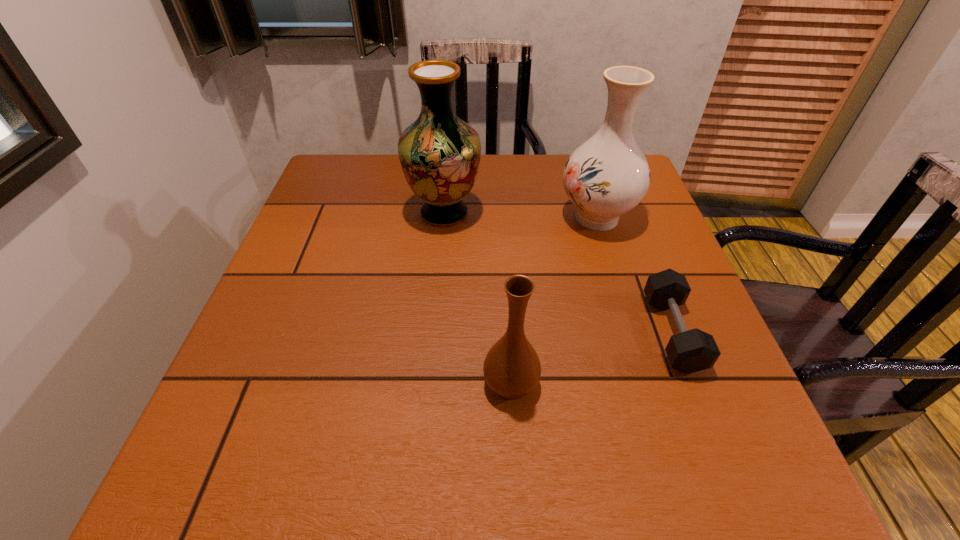
The width and height of the screenshot is (960, 540). I want to click on vase that stands as the closest to the dumbbell, so click(x=608, y=175).